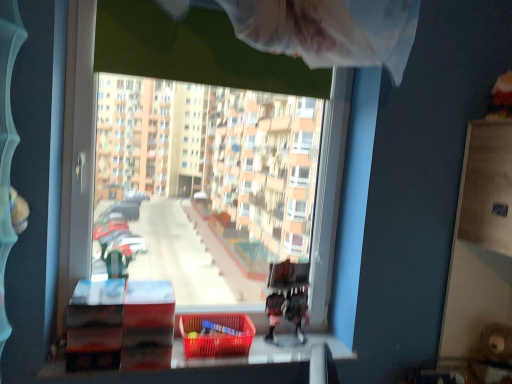
Measure the distance between wooden bunk bed at center and camera.

5.93 feet.

At what (x,y) coordinates should I click in order to perform the action: click on transparent plastic window at center. Please return your answer as a coordinate pair (x, y). Image resolution: width=512 pixels, height=384 pixels. Looking at the image, I should click on (77, 154).

This screenshot has height=384, width=512. What do you see at coordinates (77, 154) in the screenshot? I see `transparent plastic window at center` at bounding box center [77, 154].

At what (x,y) coordinates should I click in order to perform the action: click on wooden bunk bed at center. Please return your answer as a coordinate pair (x, y). Looking at the image, I should click on (287, 297).

Is translucent plastic basket at lower center at the left side of transparent plastic window at center?

Incorrect, translucent plastic basket at lower center is not on the left side of transparent plastic window at center.

Is translucent plastic basket at lower center inside or outside of transparent plastic window at center?

translucent plastic basket at lower center is spatially positioned inside transparent plastic window at center.

Considering the sizes of translucent plastic basket at lower center and transparent plastic window at center in the image, is translucent plastic basket at lower center taller or shorter than transparent plastic window at center?

Clearly, translucent plastic basket at lower center is shorter compared to transparent plastic window at center.

From the picture: Could you tell me if translucent plastic basket at lower center is turned towards transparent plastic window at center?

No, translucent plastic basket at lower center is not oriented towards transparent plastic window at center.

Is transparent plastic window at center not near wooden bunk bed at center?

Actually, transparent plastic window at center and wooden bunk bed at center are a little close together.

Between transparent plastic window at center and wooden bunk bed at center, which one appears on the right side from the viewer's perspective?

wooden bunk bed at center.

Measure the distance from transparent plastic window at center to wooden bunk bed at center.

transparent plastic window at center and wooden bunk bed at center are 87.46 centimeters apart.

Which object is thinner, transparent plastic window at center or wooden bunk bed at center?

wooden bunk bed at center is thinner.

Is transparent plastic window at center oriented towards translucent plastic basket at lower center?

Yes, transparent plastic window at center is oriented towards translucent plastic basket at lower center.

Are transparent plastic window at center and translucent plastic basket at lower center located far from each other?

No.

From a real-world perspective, does transparent plastic window at center sit lower than translucent plastic basket at lower center?

No.

Considering the relative positions of transparent plastic window at center and translucent plastic basket at lower center in the image provided, is transparent plastic window at center in front of translucent plastic basket at lower center?

Yes, transparent plastic window at center is closer to the viewer.

Based on the photo, considering the positions of objects wooden bunk bed at center and transparent plastic window at center in the image provided, who is more to the right, wooden bunk bed at center or transparent plastic window at center?

wooden bunk bed at center.

Is wooden bunk bed at center facing towards transparent plastic window at center?

Yes, wooden bunk bed at center is aimed at transparent plastic window at center.

Measure the distance from wooden bunk bed at center to transparent plastic window at center.

wooden bunk bed at center and transparent plastic window at center are 34.43 inches apart.

Could transparent plastic window at center be considered to be inside wooden bunk bed at center?

That's incorrect, transparent plastic window at center is not inside wooden bunk bed at center.

Which is in front, point (285, 287) or point (246, 351)?

The point (246, 351) is more forward.

Considering the positions of objects wooden bunk bed at center and translucent plastic basket at lower center in the image provided, who is in front, wooden bunk bed at center or translucent plastic basket at lower center?

translucent plastic basket at lower center.

From the image's perspective, who appears lower, wooden bunk bed at center or translucent plastic basket at lower center?

translucent plastic basket at lower center.

Is wooden bunk bed at center to the left of translucent plastic basket at lower center from the viewer's perspective?

Incorrect, wooden bunk bed at center is not on the left side of translucent plastic basket at lower center.

Which point is more distant from viewer, (231,314) or (271,266)?

The point (271,266) is behind.

Is translucent plastic basket at lower center wider than wooden bunk bed at center?

Correct, the width of translucent plastic basket at lower center exceeds that of wooden bunk bed at center.

There is a translucent plastic basket at lower center. At what (x,y) coordinates should I click in order to perform the action: click on bunk bed above it (from a real-world perspective). Please return your answer as a coordinate pair (x, y). The image size is (512, 384). Looking at the image, I should click on 287,297.

How far apart are translucent plastic basket at lower center and wooden bunk bed at center?

A distance of 9.33 inches exists between translucent plastic basket at lower center and wooden bunk bed at center.

Identify the location of window above the translucent plastic basket at lower center (from a real-world perspective). Image resolution: width=512 pixels, height=384 pixels. (77, 154).

The width and height of the screenshot is (512, 384). I want to click on bunk bed behind the transparent plastic window at center, so click(287, 297).

From the image, which object appears to be farther from wooden bunk bed at center, transparent plastic window at center or translucent plastic basket at lower center?

The object further to wooden bunk bed at center is transparent plastic window at center.

Which object lies further to the anchor point transparent plastic window at center, translucent plastic basket at lower center or wooden bunk bed at center?

The object further to transparent plastic window at center is wooden bunk bed at center.

Considering their positions, is transparent plastic window at center positioned further to translucent plastic basket at lower center than wooden bunk bed at center?

transparent plastic window at center lies further to translucent plastic basket at lower center than the other object.

Based on their spatial positions, is wooden bunk bed at center or translucent plastic basket at lower center further from transparent plastic window at center?

Based on the image, wooden bunk bed at center appears to be further to transparent plastic window at center.

In the scene shown: Estimate the real-world distances between objects in this image. Which object is further from wooden bunk bed at center, translucent plastic basket at lower center or transparent plastic window at center?

transparent plastic window at center.

From the image, which object appears to be farther from translucent plastic basket at lower center, wooden bunk bed at center or transparent plastic window at center?

transparent plastic window at center.

Identify the location of bunk bed between transparent plastic window at center and translucent plastic basket at lower center in the up-down direction. (287, 297).